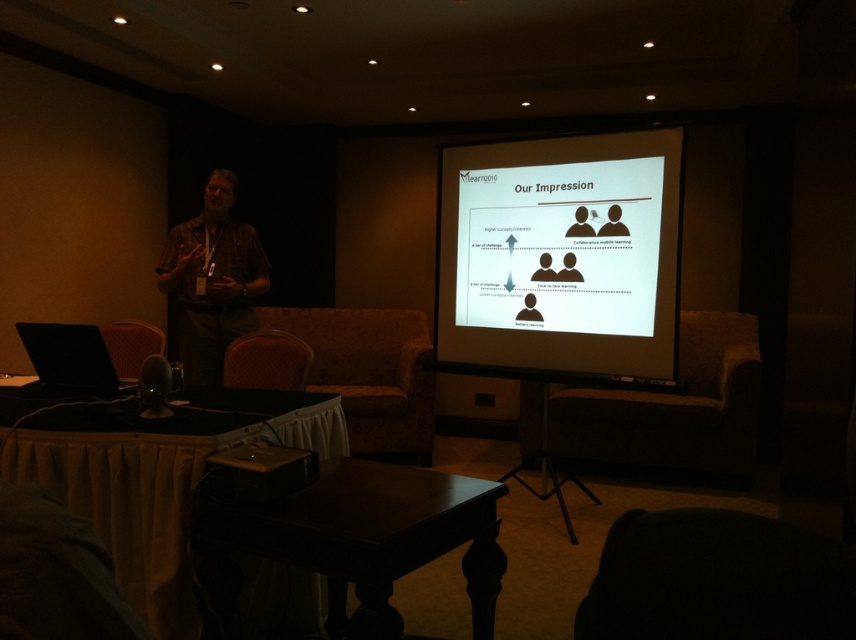
Question: Does brown fabric armchair at center come in front of matte plaid shirt at left?

Choices:
 (A) yes
 (B) no

Answer: (B)

Question: Is brown fabric armchair at center to the left of black plastic projector at lower center from the viewer's perspective?

Choices:
 (A) no
 (B) yes

Answer: (A)

Question: Considering the real-world distances, which object is farthest from the matte black microphone at lower left?

Choices:
 (A) white glossy projector screen at upper center
 (B) black plastic projector at lower center
 (C) brown fabric armchair at center

Answer: (C)

Question: Which object appears farthest from the camera in this image?

Choices:
 (A) white glossy projector screen at upper center
 (B) black plastic projector at lower center
 (C) matte black microphone at lower left

Answer: (A)

Question: Is matte black laptop at left to the left of velvet red armchair at lower left from the viewer's perspective?

Choices:
 (A) no
 (B) yes

Answer: (A)

Question: Which object appears farthest from the camera in this image?

Choices:
 (A) dark fabric armchair at lower right
 (B) matte plaid shirt at left

Answer: (B)